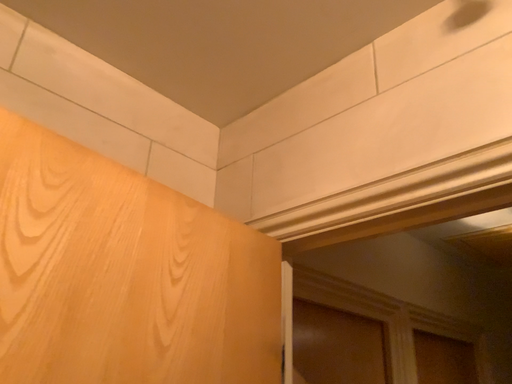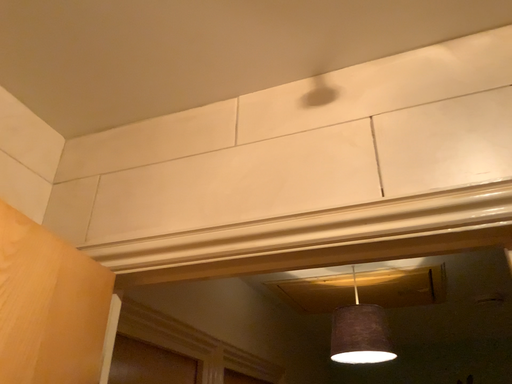
Question: How did the camera likely rotate when shooting the video?

Choices:
 (A) rotated left
 (B) rotated right

Answer: (B)